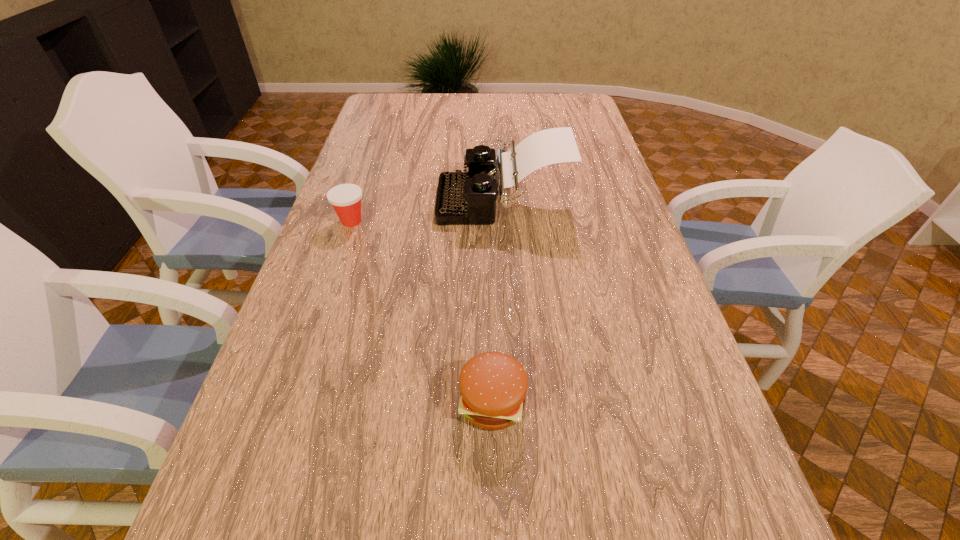
Identify the location of vacant space at the left edge of the desktop. (281, 373).

The height and width of the screenshot is (540, 960). Find the location of `free region at the right edge`. free region at the right edge is located at coordinates (676, 471).

I want to click on free location at the far left corner, so click(x=372, y=115).

Where is `free space at the far right corner of the desktop`? The height and width of the screenshot is (540, 960). free space at the far right corner of the desktop is located at coordinates (568, 94).

Find the location of a particular element. Image resolution: width=960 pixels, height=540 pixels. unoccupied area between the tallest object and the hamburger is located at coordinates (497, 301).

The width and height of the screenshot is (960, 540). Identify the location of free point between the hamburger and the typewriter. (497, 301).

At what (x,y) coordinates should I click in order to perform the action: click on vacant space that's between the leftmost object and the tallest object. Please return your answer as a coordinate pair (x, y). The width and height of the screenshot is (960, 540). Looking at the image, I should click on (427, 211).

Locate an element on the screen. vacant space in between the nearest object and the Dixie cup is located at coordinates (422, 312).

Identify the location of free spot between the hamburger and the leftmost object. (422, 312).

Locate an element on the screen. The width and height of the screenshot is (960, 540). object identified as the closest to the tallest object is located at coordinates (345, 198).